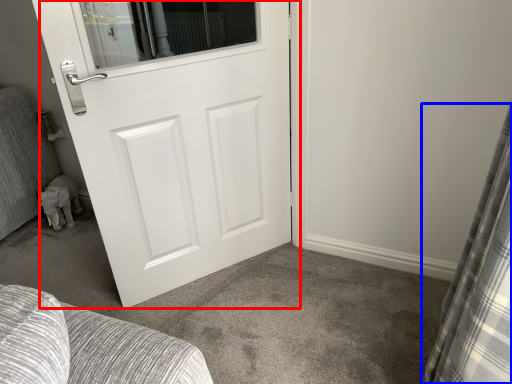
Question: Which of the following is the closest to the observer, door (highlighted by a red box) or curtain (highlighted by a blue box)?

Choices:
 (A) door
 (B) curtain

Answer: (B)